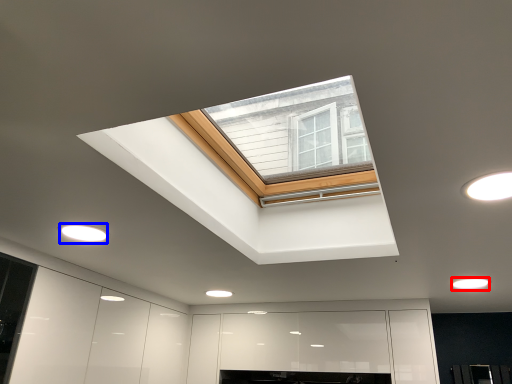
Question: Which object is further to the camera taking this photo, lighting (highlighted by a red box) or lighting (highlighted by a blue box)?

Choices:
 (A) lighting
 (B) lighting

Answer: (A)